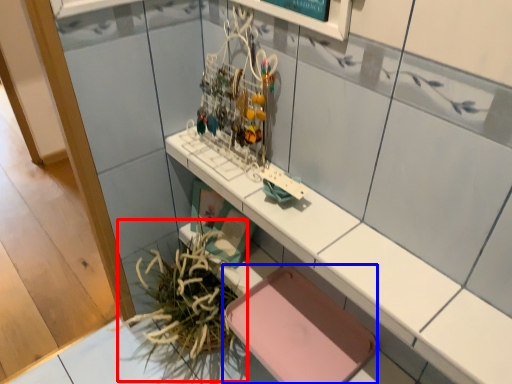
Question: Which point is closer to the camera, plant (highlighted by a red box) or chair (highlighted by a blue box)?

Choices:
 (A) plant
 (B) chair

Answer: (B)